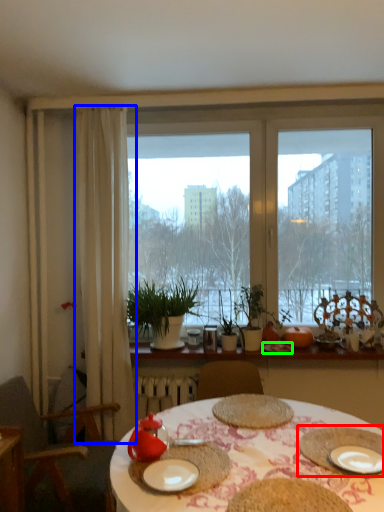
Question: Which object is positioned farthest from platter (highlighted by a red box)? Select from curtain (highlighted by a blue box) and tableware (highlighted by a green box).

Choices:
 (A) curtain
 (B) tableware

Answer: (A)